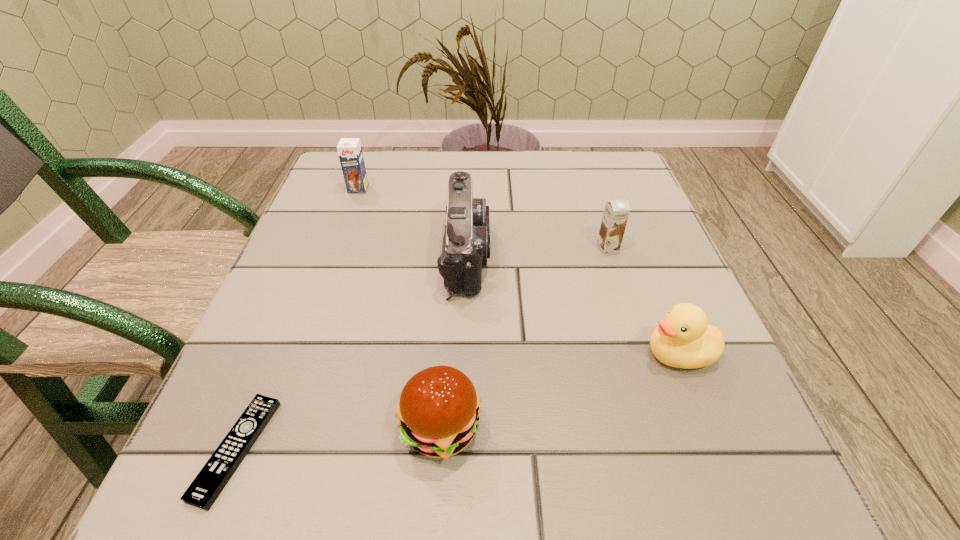
In the image, there is a desktop. Identify the location of vacant region at the near right corner. (692, 497).

The width and height of the screenshot is (960, 540). I want to click on free spot between the hamburger and the camcorder, so click(453, 341).

I want to click on free space between the camcorder and the shortest object, so click(x=351, y=352).

This screenshot has height=540, width=960. I want to click on free space between the remote control and the hamburger, so click(x=339, y=438).

At what (x,y) coordinates should I click in order to perform the action: click on vacant region between the duckling and the hamburger. Please return your answer as a coordinate pair (x, y). The width and height of the screenshot is (960, 540). Looking at the image, I should click on (560, 390).

At what (x,y) coordinates should I click in order to perform the action: click on free space between the left chocolate milk and the duckling. Please return your answer as a coordinate pair (x, y). Image resolution: width=960 pixels, height=540 pixels. Looking at the image, I should click on (518, 271).

You are a GUI agent. You are given a task and a screenshot of the screen. Output one action in this format:
    pyautogui.click(x=<x>, y=<y>)
    Task: Click on the vacant area that lies between the fourth farthest object and the camcorder
    The image size is (960, 540).
    Given the screenshot: What is the action you would take?
    pyautogui.click(x=572, y=303)

At what (x,y) coordinates should I click in order to perform the action: click on free space between the right chocolate milk and the camcorder. Please return your answer as a coordinate pair (x, y). This screenshot has height=540, width=960. Looking at the image, I should click on (537, 251).

In order to click on empty space that is in between the farthest object and the hamburger in this screenshot , I will do [399, 308].

At what (x,y) coordinates should I click in order to perform the action: click on empty space that is in between the third nearest object and the right chocolate milk. Please return your answer as a coordinate pair (x, y). The height and width of the screenshot is (540, 960). Looking at the image, I should click on tap(643, 300).